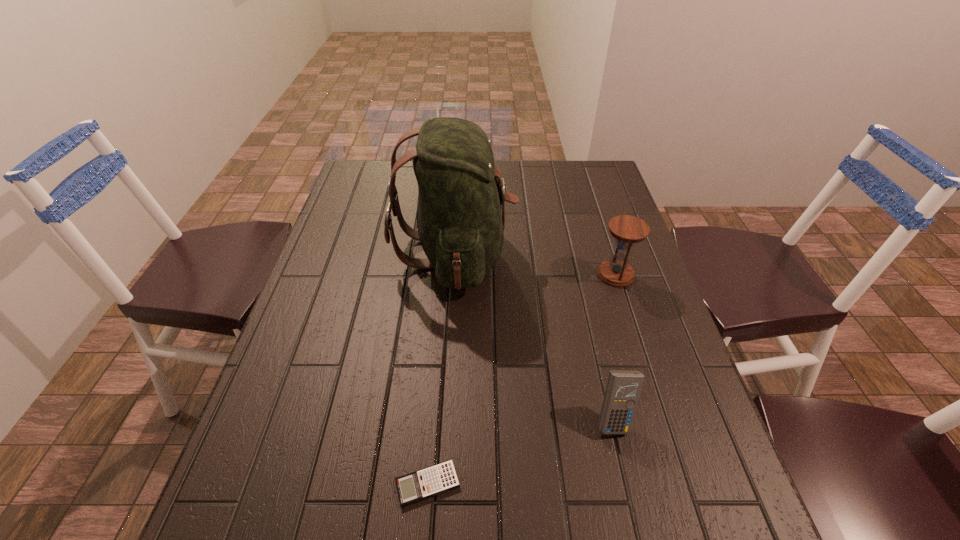
Image resolution: width=960 pixels, height=540 pixels. Identify the location of hourglass at the right edge. (627, 230).

Find the location of a particular element. calculator positioned at the right edge is located at coordinates (x=623, y=388).

Image resolution: width=960 pixels, height=540 pixels. Find the location of `vacant space at the far edge of the desktop`. vacant space at the far edge of the desktop is located at coordinates (510, 176).

You are a GUI agent. You are given a task and a screenshot of the screen. Output one action in this format:
    pyautogui.click(x=<x>, y=<y>)
    Task: Click on the free space at the left edge
    This screenshot has width=960, height=540.
    Given the screenshot: What is the action you would take?
    pyautogui.click(x=374, y=215)

Locate an element on the screen. vacant space at the right edge of the desktop is located at coordinates (583, 206).

Locate an element on the screen. The image size is (960, 540). free location at the far right corner is located at coordinates (578, 173).

Where is `vacant space in between the second tallest object and the second shortest object`? The height and width of the screenshot is (540, 960). vacant space in between the second tallest object and the second shortest object is located at coordinates (614, 347).

Where is `free point between the right calculator and the second tallest object`? Image resolution: width=960 pixels, height=540 pixels. free point between the right calculator and the second tallest object is located at coordinates (614, 347).

This screenshot has width=960, height=540. Identify the location of free space between the second shortest object and the backpack. (534, 336).

The image size is (960, 540). I want to click on free space between the second object from right to left and the nearest object, so click(x=520, y=452).